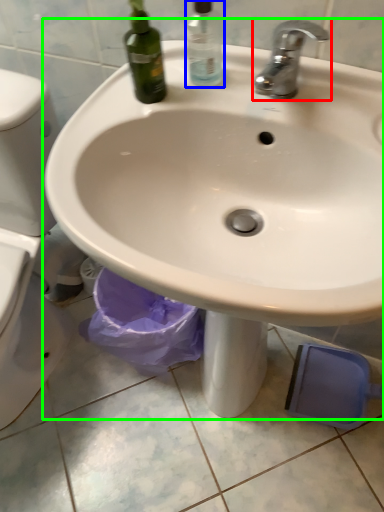
Question: Estimate the real-world distances between objects in this image. Which object is farther from tap (highlighted by a red box), cleaning product (highlighted by a blue box) or sink (highlighted by a green box)?

Choices:
 (A) cleaning product
 (B) sink

Answer: (B)